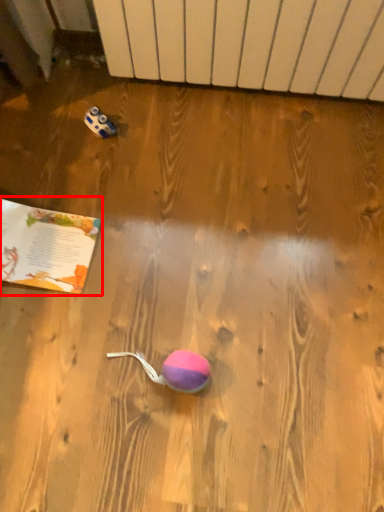
Question: From the image, what is the correct spatial relationship of book (annotated by the red box) in relation to radiator?

Choices:
 (A) right
 (B) left

Answer: (B)